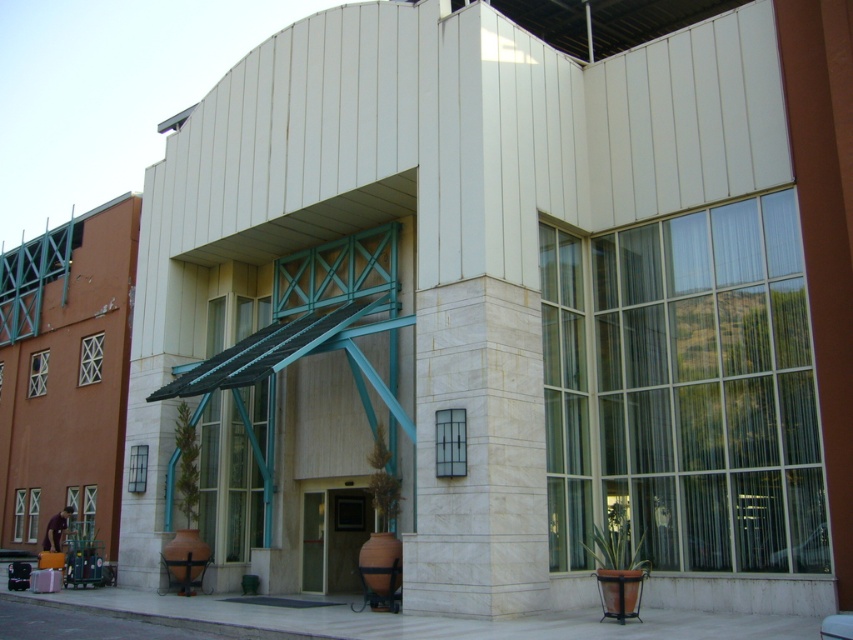
Question: Is white marble pillar at center wider than metallic door at center?

Choices:
 (A) yes
 (B) no

Answer: (B)

Question: Is white marble pillar at center wider than metallic door at center?

Choices:
 (A) no
 (B) yes

Answer: (A)

Question: Among these points, which one is nearest to the camera?

Choices:
 (A) (492, 285)
 (B) (329, 532)

Answer: (A)

Question: Can you confirm if white marble pillar at center is smaller than metallic door at center?

Choices:
 (A) yes
 (B) no

Answer: (A)

Question: Which point appears closest to the camera in this image?

Choices:
 (A) (343, 579)
 (B) (503, 554)

Answer: (B)